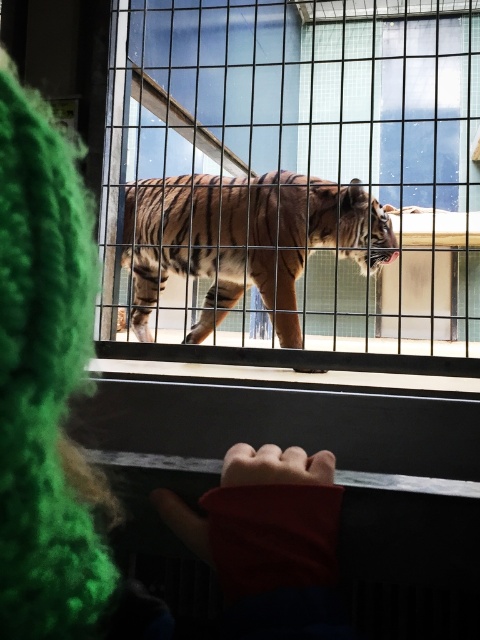
Question: Which point is closer to the camera taking this photo?

Choices:
 (A) (237, 218)
 (B) (191, 288)

Answer: (A)

Question: From the image, what is the correct spatial relationship of clear glass window at center in relation to striped fur tiger at center?

Choices:
 (A) right
 (B) left

Answer: (A)

Question: Where is green fuzzy sweater at upper left located in relation to striped fur tiger at center in the image?

Choices:
 (A) below
 (B) above

Answer: (A)

Question: Which of the following is the farthest from the observer?

Choices:
 (A) clear glass window at center
 (B) green fuzzy sweater at upper left
 (C) striped fur tiger at center

Answer: (C)

Question: Is green fuzzy sweater at upper left to the left of striped fur tiger at center from the viewer's perspective?

Choices:
 (A) yes
 (B) no

Answer: (B)

Question: Considering the real-world distances, which object is closest to the green fuzzy sweater at upper left?

Choices:
 (A) striped fur tiger at center
 (B) clear glass window at center

Answer: (B)